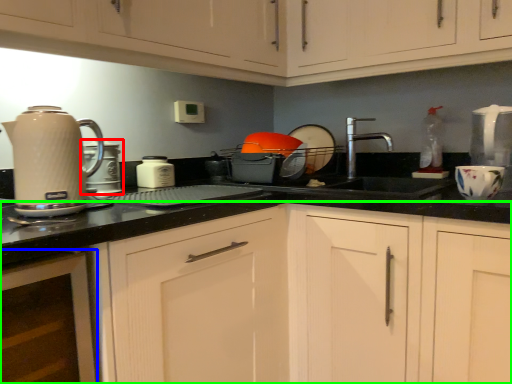
Question: Which object is positioned farthest from kitchen appliance (highlighted by a red box)? Select from cabinetry (highlighted by a blue box) and cabinetry (highlighted by a green box).

Choices:
 (A) cabinetry
 (B) cabinetry

Answer: (B)